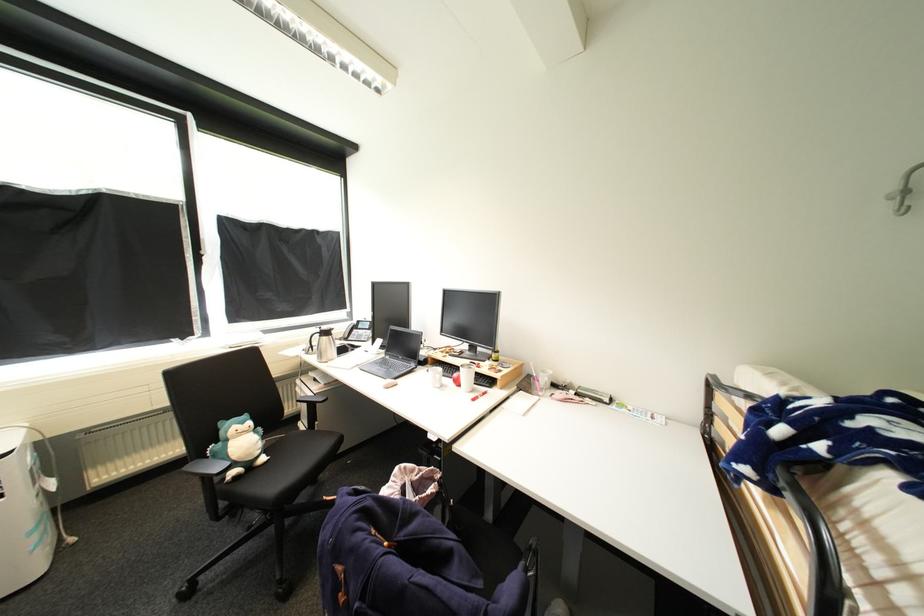
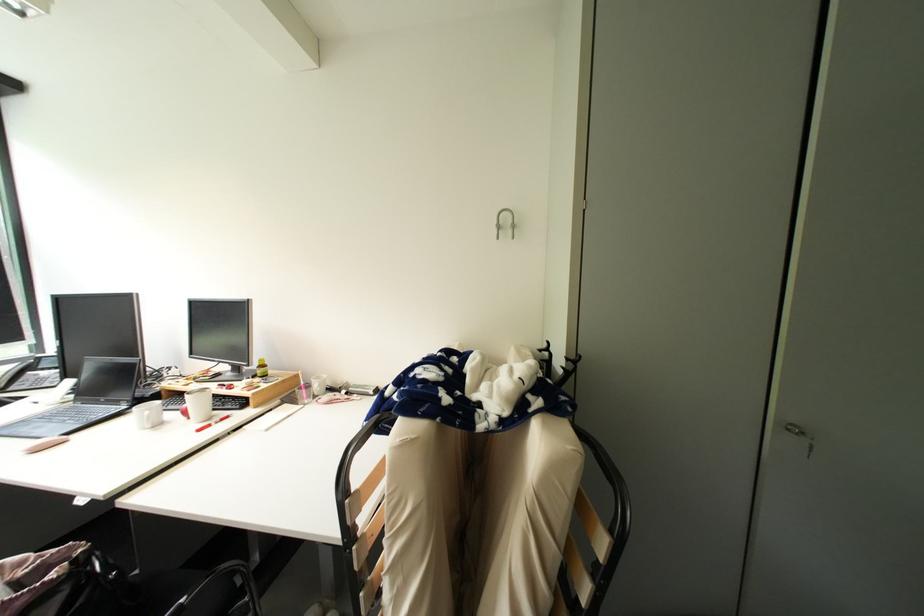
From the picture: Which direction would the cameraman need to move to produce the second image?

The movement direction of the cameraman is right, backward.